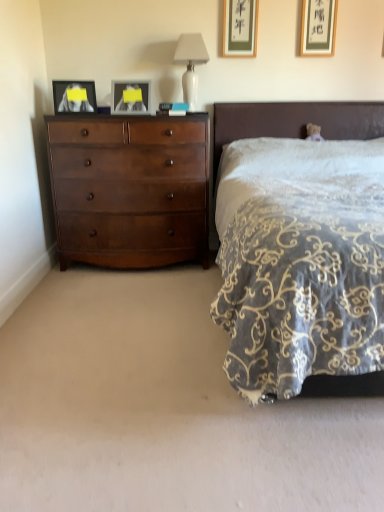
Find the location of a particular element. This screenshot has height=512, width=384. free space below matte black picture frame at left, marked as the first picture frame in a left-to-right arrangement (from a real-world perspective) is located at coordinates (66, 113).